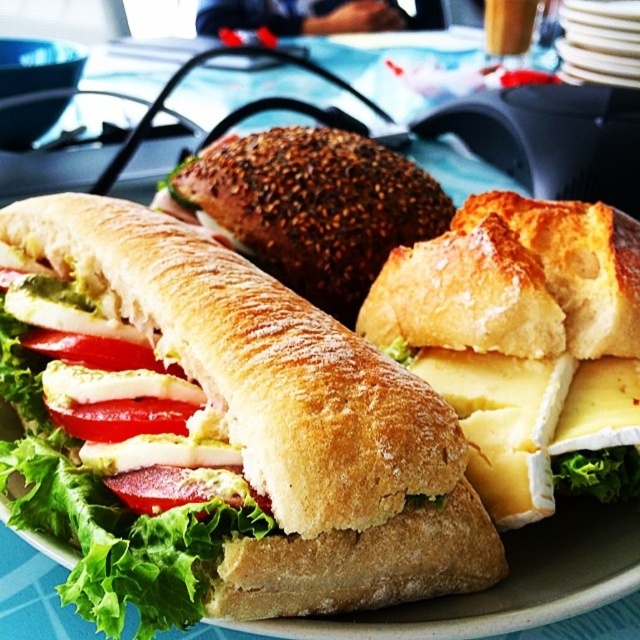
You are a food stylist arranging a photo shoot. You need to place a red glossy tomato at center in front of the breadsoftsandwich at center to make it look more appetizing. Is this possible based on their current positions?

The breadsoftsandwich at center is located above the red glossy tomato at center, so placing the red glossy tomato at center in front would require moving the breadsoftsandwich at center downward to create space below it.

You are a chef preparing a dish and need to place both the yellow creamy cheese at center and the white ceramic plate at upper right on a table. Based on their sizes, which object should you place first to ensure stability?

The yellow creamy cheese at center is bigger than the white ceramic plate at upper right, so you should place the yellow creamy cheese at center first to ensure stability.